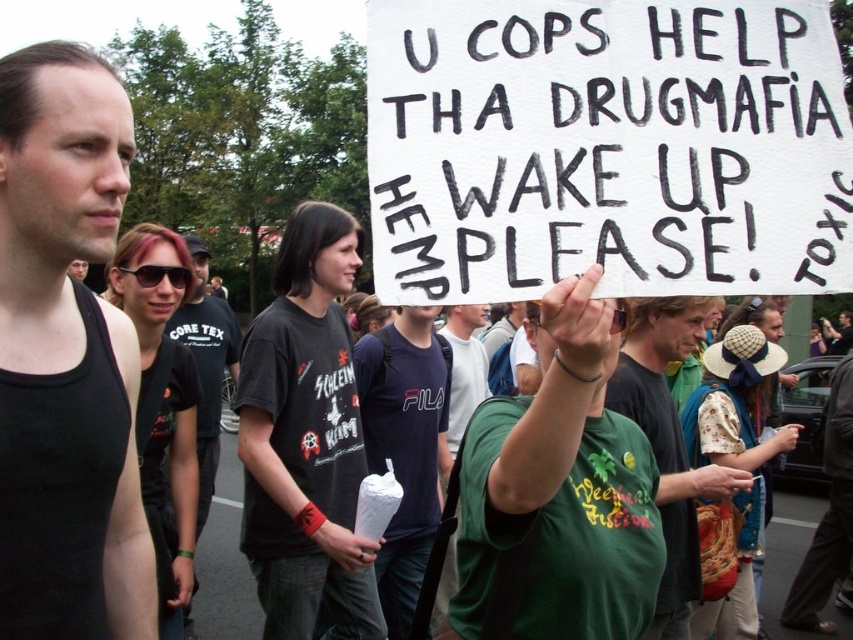
Question: Where is green fabric shirt at center located in relation to black cotton t-shirt at center in the image?

Choices:
 (A) above
 (B) below

Answer: (B)

Question: Estimate the real-world distances between objects in this image. Which object is closer to the black cotton t-shirt at center?

Choices:
 (A) green fabric shirt at center
 (B) black tank top at left

Answer: (A)

Question: Considering the real-world distances, which object is farthest from the green fabric shirt at center?

Choices:
 (A) black cotton t-shirt at center
 (B) black tank top at left

Answer: (A)

Question: Is black tank top at left positioned in front of green fabric shirt at center?

Choices:
 (A) no
 (B) yes

Answer: (B)

Question: Which object appears farthest from the camera in this image?

Choices:
 (A) black cotton t-shirt at center
 (B) green fabric shirt at center

Answer: (A)

Question: Where is green fabric shirt at center located in relation to black cotton t-shirt at center in the image?

Choices:
 (A) below
 (B) above

Answer: (A)